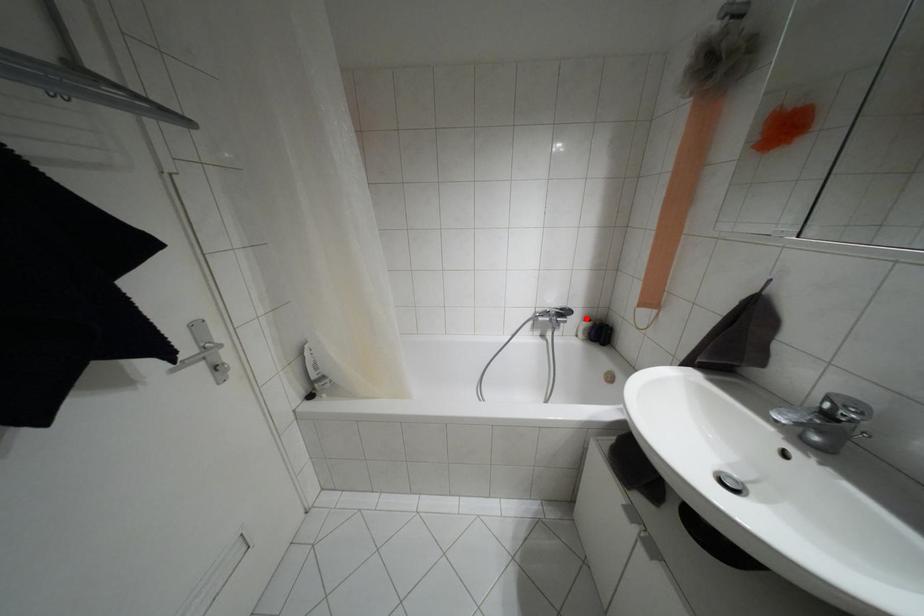
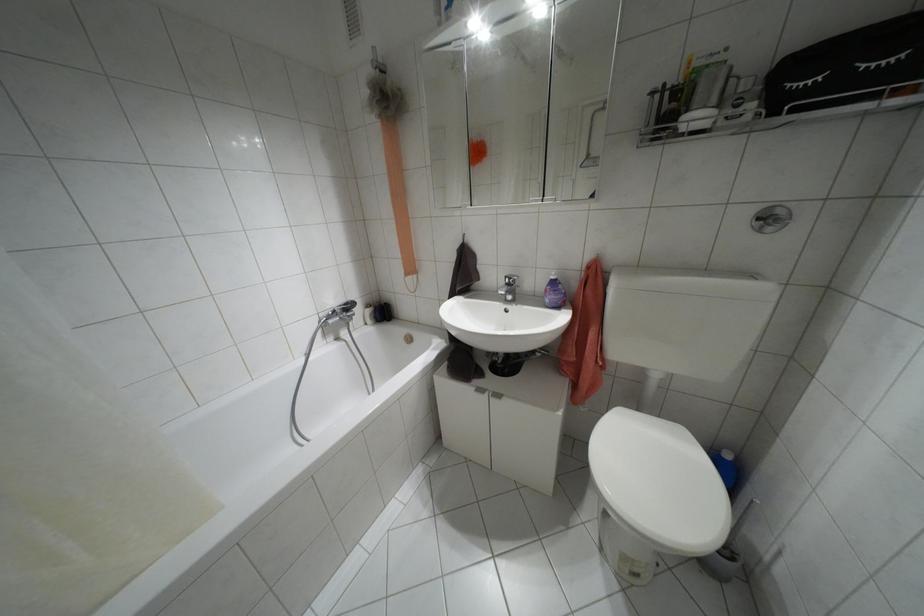
Locate, in the second image, the point that corresponds to the highlighted location in the first image.

(367, 305)